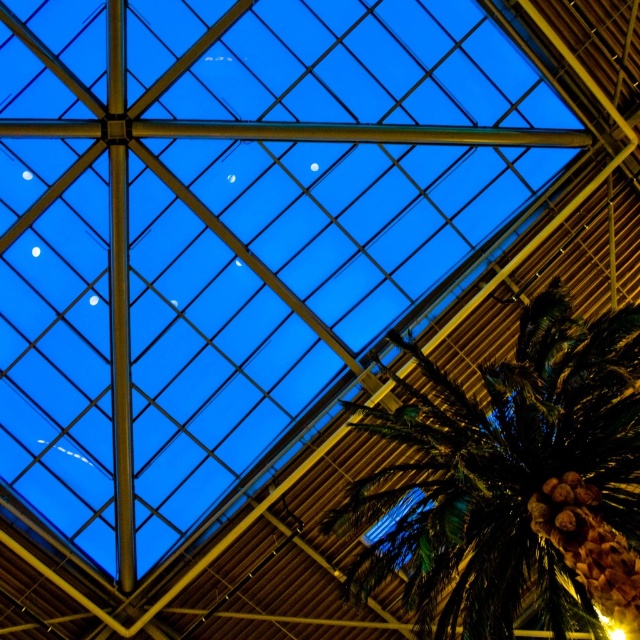
Is green leafy palm tree at lower right bigger than metallic beam at center?

Yes.

Which is in front, point (620, 563) or point (406, 134)?

Point (620, 563) is more forward.

Locate an element on the screen. green leafy palm tree at lower right is located at coordinates (512, 481).

I want to click on green leafy palm tree at lower right, so click(512, 481).

Find the location of a particular element. The width and height of the screenshot is (640, 640). brown matte pine cone at lower right is located at coordinates (589, 547).

Which is in front, point (602, 532) or point (496, 140)?

Point (602, 532)

Where is `brown matte pine cone at lower right`? brown matte pine cone at lower right is located at coordinates (x=589, y=547).

Measure the distance between green leafy palm tree at lower right and camera.

A distance of 19.85 meters exists between green leafy palm tree at lower right and camera.

Is green leafy palm tree at lower right in front of brown matte pine cone at lower right?

Yes, green leafy palm tree at lower right is closer to the viewer.

Which is behind, point (536, 474) or point (577, 545)?

Positioned behind is point (536, 474).

Image resolution: width=640 pixels, height=640 pixels. In order to click on green leafy palm tree at lower right in this screenshot , I will do `click(512, 481)`.